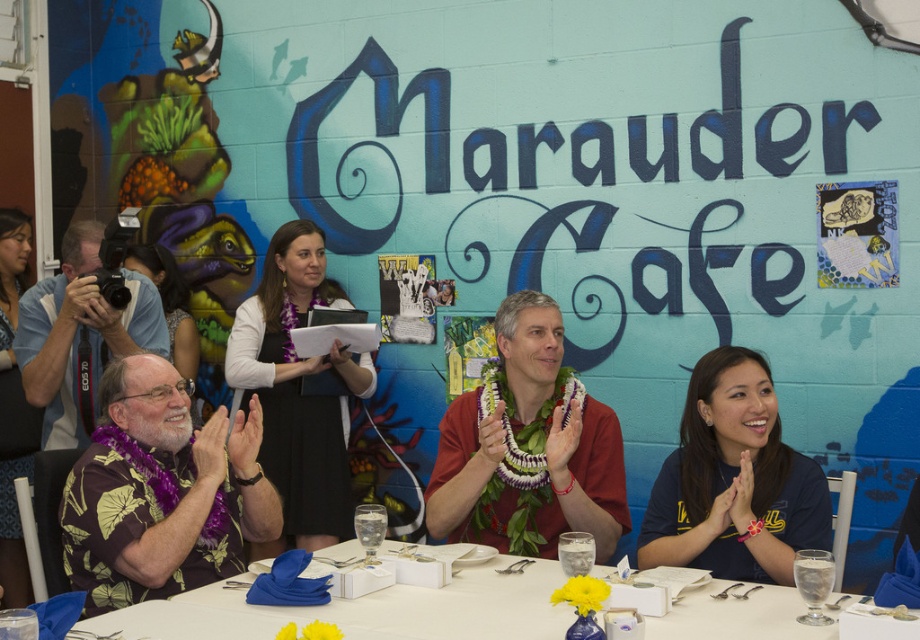
Based on the photo, you are at the Marauder Cafe event and want to place a small gift exactly where the reddish brown fabric lei at center is. The cafe manager says you can only place it if the lei is at the coordinate point (x=529, y=449). Is the lei at that location?

Yes, the reddish brown fabric lei at center is located at point (x=529, y=449), so you can place the gift there.